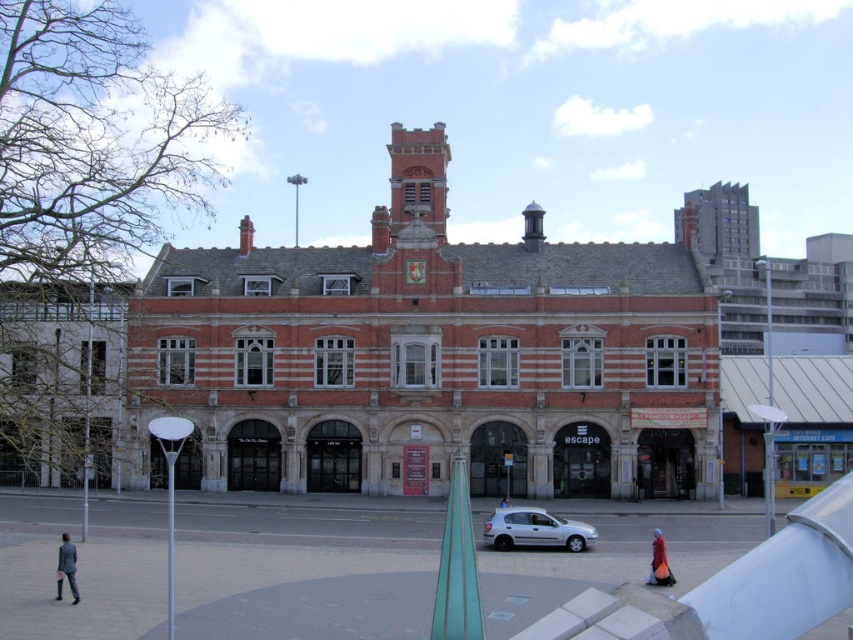
You are a photographer standing in front of the red brick building. You want to take a photo of the silver metallic car at lower center and the red velvet dress at lower right. Which object is located to the left of the other?

The silver metallic car at lower center is positioned on the left side of red velvet dress at lower right.

You are a photographer standing in front of the red brick building. You want to take a photo that includes both the silver metallic car at lower center and the dark gray suit at lower left. Which object will appear taller in the photo?

The dark gray suit at lower left will appear taller in the photo because the silver metallic car at lower center is not as tall as the dark gray suit at lower left.

You are a delivery person needing to park your motorcycle between the silver metallic car at lower center and the dark gray suit at lower left. Can your motorcycle fit there?

The silver metallic car at lower center is wider than the dark gray suit at lower left. Since the motorcycle requires space between them, the width difference suggests there might be enough space, but the exact fit depends on the motorcycle size. However, since the car is wider, the gap may accommodate the motorcycle if it is narrower than the difference in their widths.